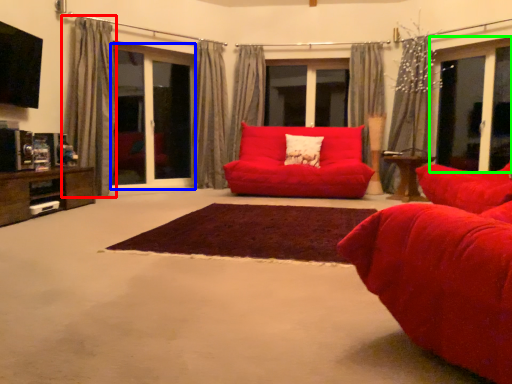
Question: Which object is positioned closest to curtain (highlighted by a red box)? Select from screen door (highlighted by a blue box) and window (highlighted by a green box).

Choices:
 (A) screen door
 (B) window

Answer: (A)